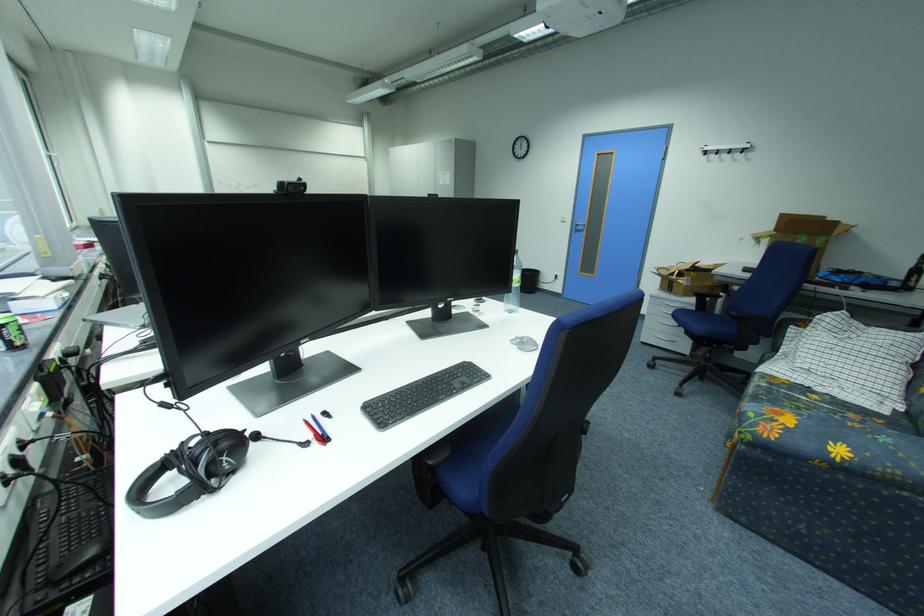
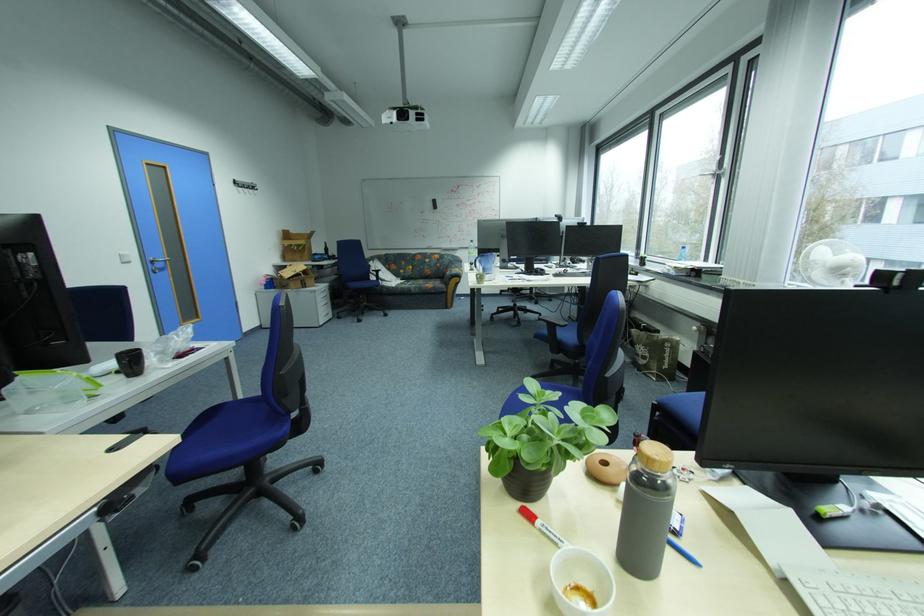
Find the pixel in the second image that matches point (588, 228) in the first image.

(167, 265)